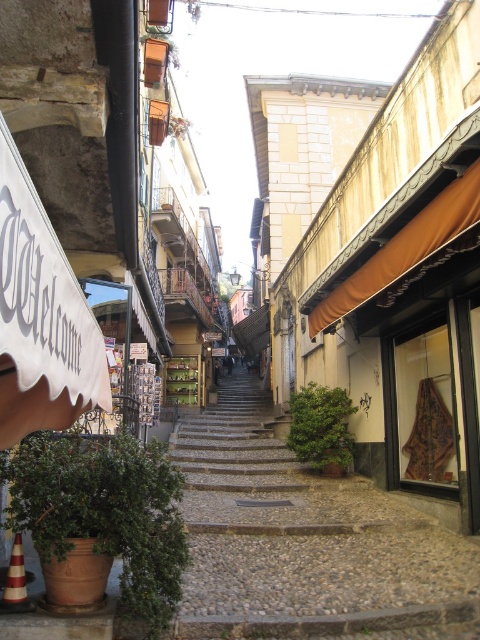
Question: Can you confirm if smooth stone stairs at center is wider than orange traffic cone at lower left?

Choices:
 (A) yes
 (B) no

Answer: (A)

Question: Which of the following is the farthest from the observer?

Choices:
 (A) smooth stone stairs at center
 (B) orange traffic cone at lower left

Answer: (A)

Question: Is smooth stone stairs at center below orange traffic cone at lower left?

Choices:
 (A) no
 (B) yes

Answer: (B)

Question: Does smooth stone stairs at center have a larger size compared to orange traffic cone at lower left?

Choices:
 (A) yes
 (B) no

Answer: (A)